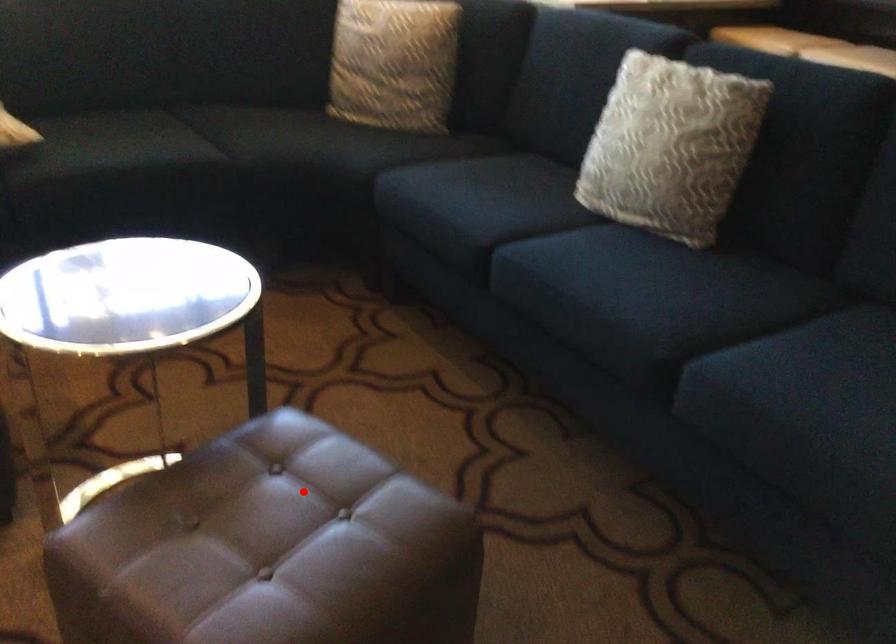
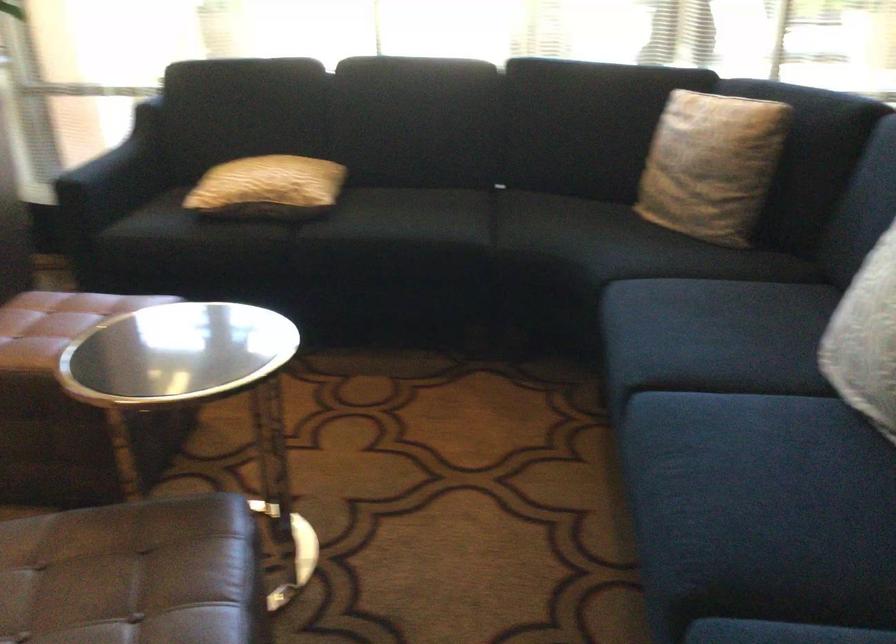
The point at the highlighted location is marked in the first image. Where is the corresponding point in the second image?

(134, 574)